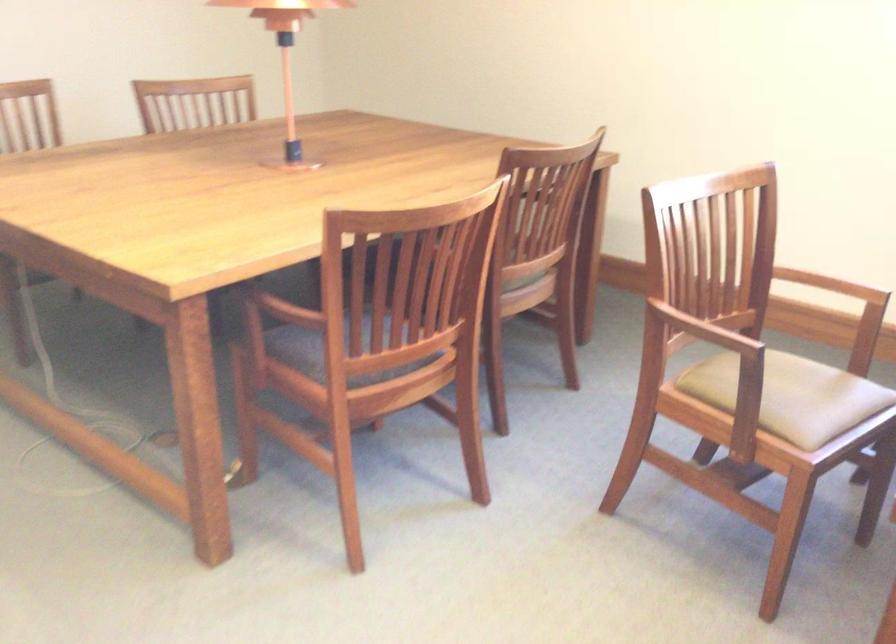
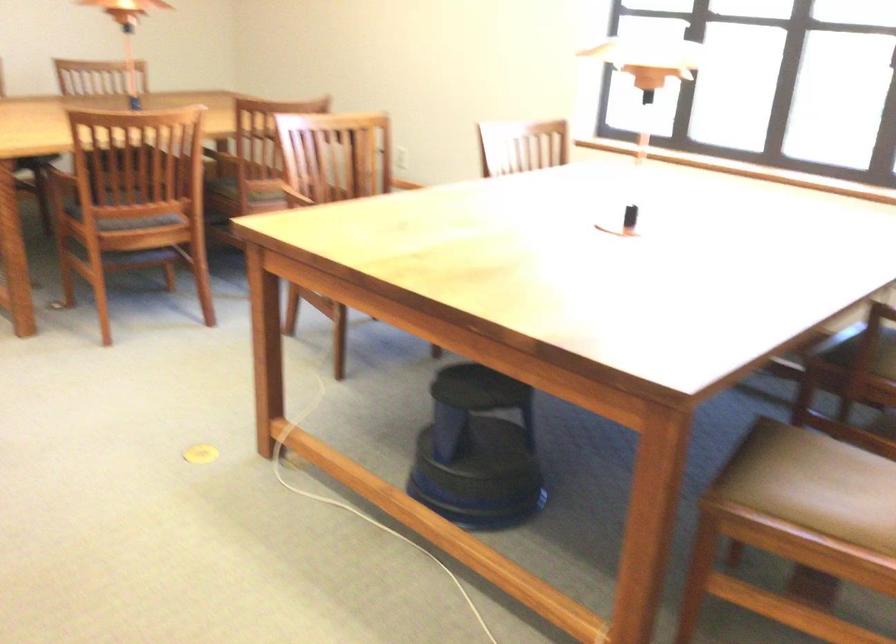
Question: I am providing you with two images of the same scene from different viewpoints. After the viewpoint changes to image2, which objects are now occluded?

Choices:
 (A) grey chair sitting surface
 (B) white flower vase
 (C) brown chair armrest
 (D) black step stool

Answer: (A)